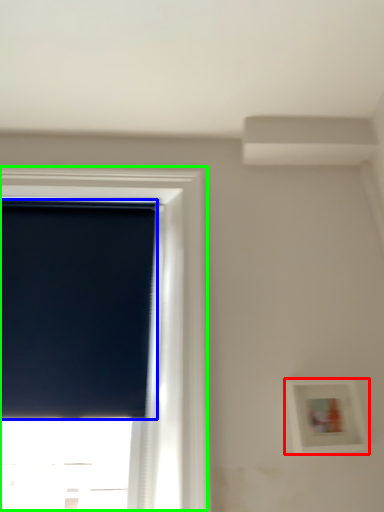
Question: Which object is the closest to the picture frame (highlighted by a red box)? Choose among these: window screen (highlighted by a blue box) or window (highlighted by a green box).

Choices:
 (A) window screen
 (B) window

Answer: (B)